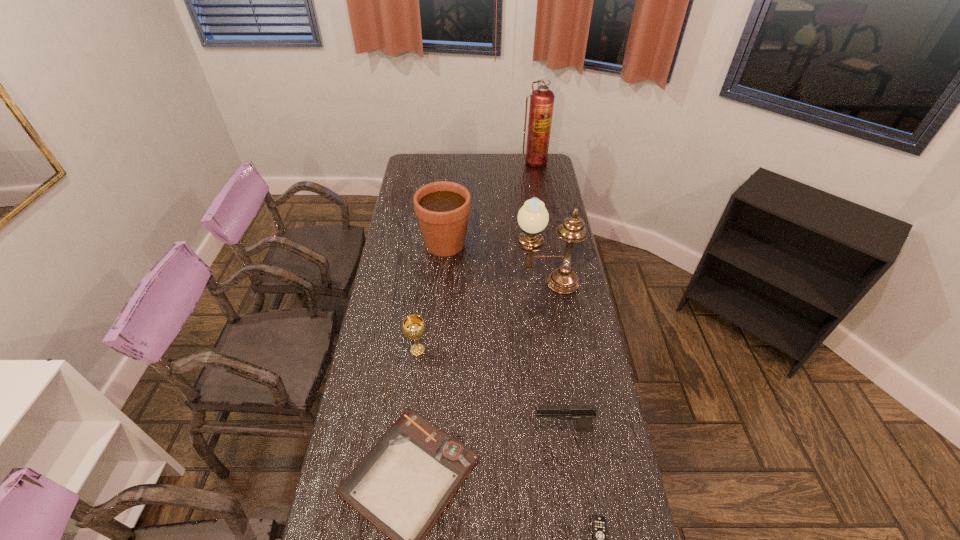
What are the coordinates of `object that ranks as the closest to the flowerpot` in the screenshot? It's located at (533, 217).

In order to click on blank area in the image that satisfies the following two spatial constraints: 1. on the front side of the third tallest object; 2. on the left side of the oil lamp in this screenshot , I will do `click(442, 283)`.